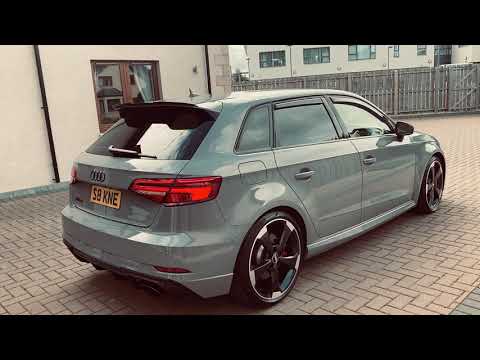
Locate an element on the screen. This screenshot has height=360, width=480. windows is located at coordinates (116, 90), (139, 88).